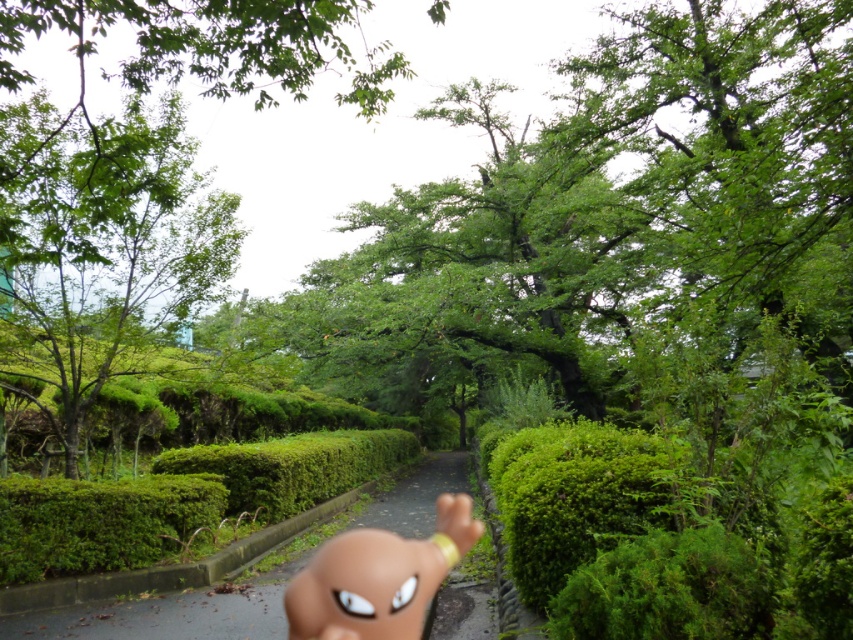
You are standing at the starting point of the pathway in the serene outdoor scene. You notice two points marked on the path ahead. The first point is at coordinates point [149,330] and the second is at point [376,502]. Which of these two points is closer to your current position?

Point [149,330] is closer to the viewer than point [376,502], so the first point is closer to your current position.

You are standing at the starting point of the pathway and want to reach the end. There are two points marked on the path, one at coordinates point (160, 189) and the other at point (676, 452). Which point should you walk towards first if you want to reach the end of the path as quickly as possible?

You should walk towards point (160, 189) first because it is closer to you than point (676, 452), which is further away. Since it is closer, reaching it first would help you progress towards the end of the path more efficiently.